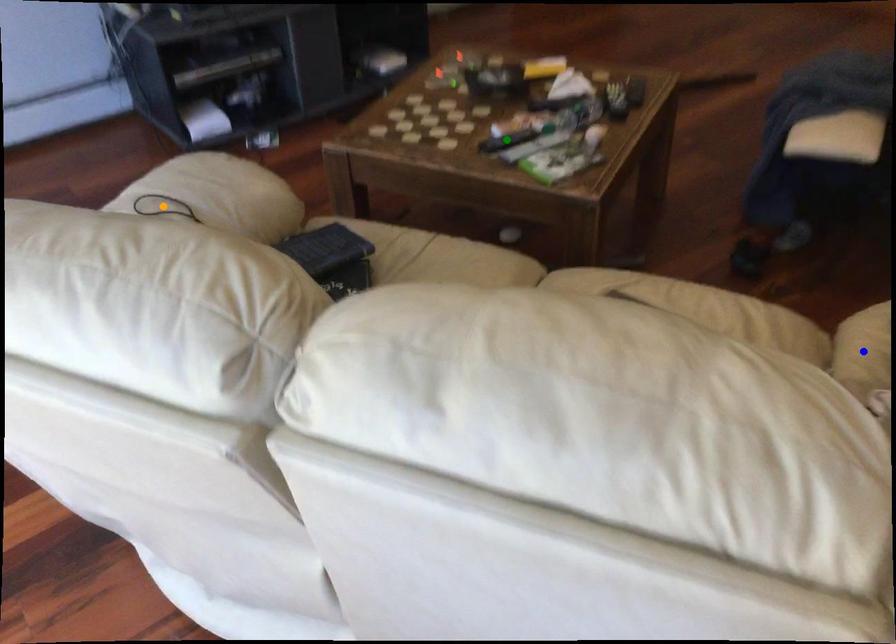
Order these from farthest to nearest:
A) green point
B) orange point
C) blue point

1. green point
2. orange point
3. blue point